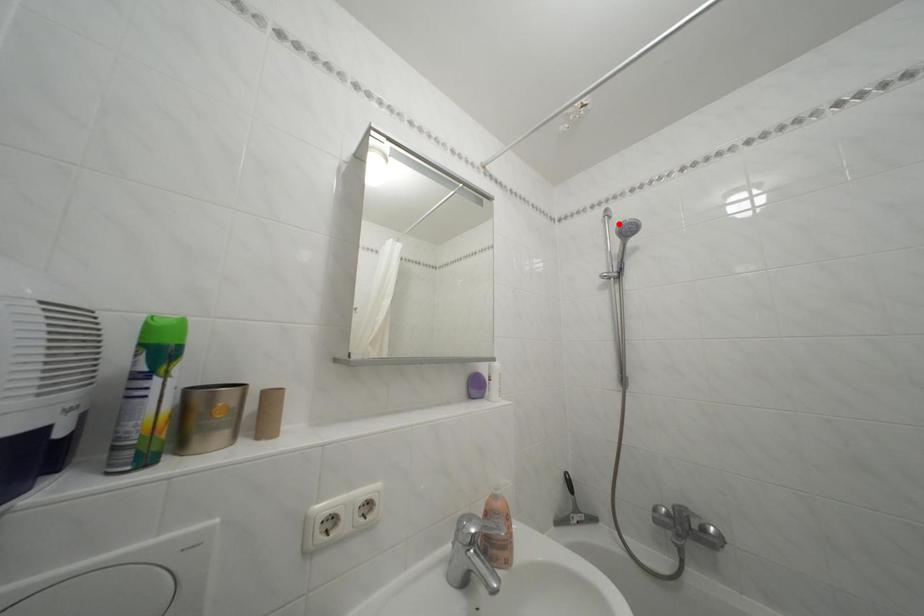
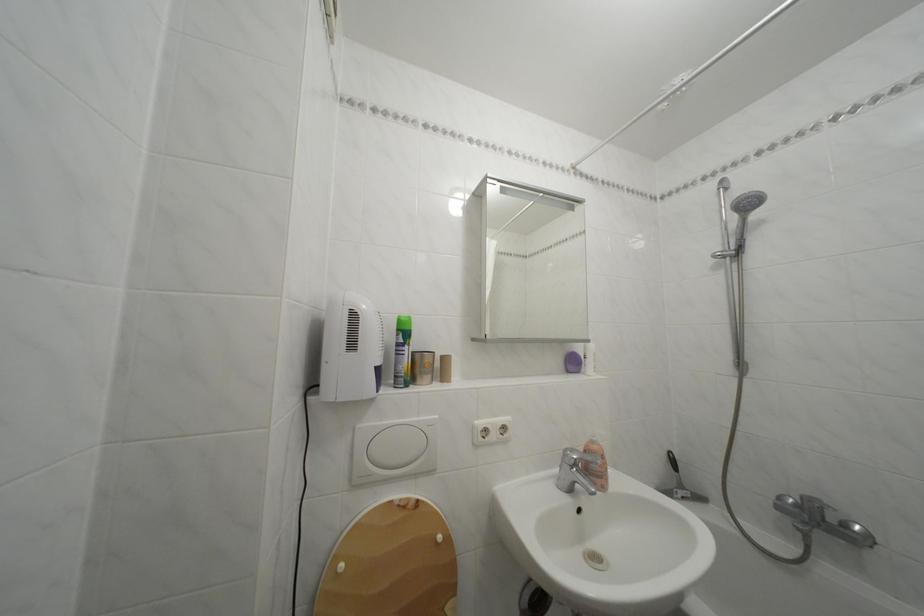
The point at the highlighted location is marked in the first image. Where is the corresponding point in the second image?

(736, 195)